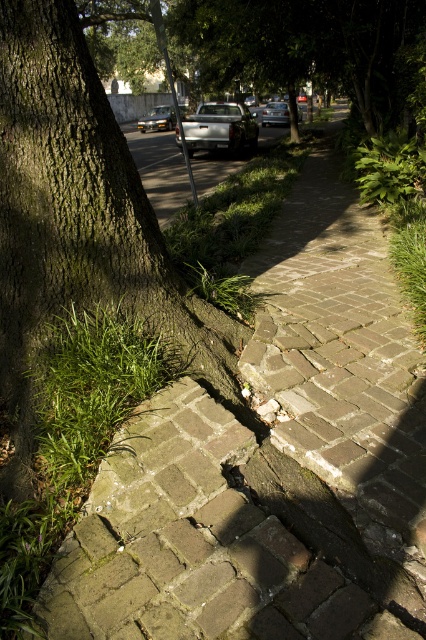
Question: Can you confirm if metallic silver sedan at center is positioned to the right of shiny silver sedan at center?

Choices:
 (A) yes
 (B) no

Answer: (B)

Question: Which point appears farthest from the camera in this image?

Choices:
 (A) (296, 104)
 (B) (6, 307)
 (C) (322, 8)

Answer: (A)

Question: Is silver metallic truck at center positioned at the back of shiny silver sedan at center?

Choices:
 (A) yes
 (B) no

Answer: (B)

Question: Is silver metallic truck at center above shiny silver sedan at center?

Choices:
 (A) yes
 (B) no

Answer: (B)

Question: Among these points, which one is nearest to the camera?

Choices:
 (A) (230, 122)
 (B) (270, 109)
 (C) (2, 324)
 (D) (167, 108)

Answer: (C)

Question: Which object appears farthest from the camera in this image?

Choices:
 (A) metallic silver sedan at center
 (B) shiny silver sedan at center
 (C) silver metallic truck at center

Answer: (A)